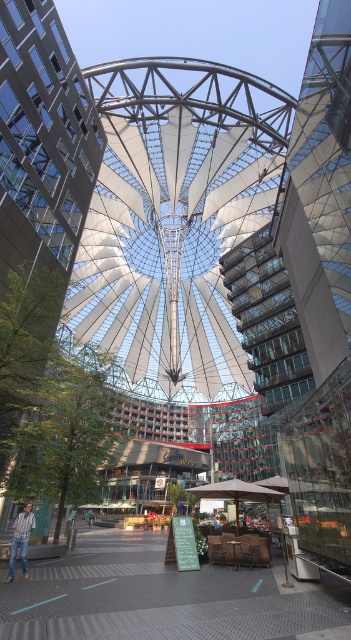
Between transparent glass tower at center and glassy modern building at center, which one is positioned higher?

glassy modern building at center

Does transparent glass tower at center appear on the left side of glassy modern building at center?

No, transparent glass tower at center is not to the left of glassy modern building at center.

Does point (323, 369) lie behind point (14, 244)?

Yes.

The height and width of the screenshot is (640, 351). What are the coordinates of `transparent glass tower at center` in the screenshot? It's located at (314, 291).